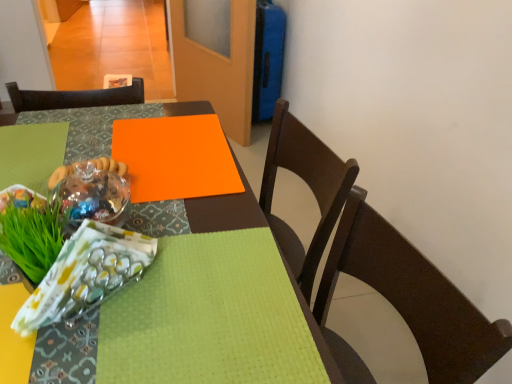
Question: Can green leafy grass at lower left be found inside orange matte board at center?

Choices:
 (A) no
 (B) yes

Answer: (A)

Question: Does orange matte board at center have a lesser width compared to green leafy grass at lower left?

Choices:
 (A) yes
 (B) no

Answer: (B)

Question: From a real-world perspective, is orange matte board at center on green leafy grass at lower left?

Choices:
 (A) yes
 (B) no

Answer: (B)

Question: Is orange matte board at center located outside green leafy grass at lower left?

Choices:
 (A) yes
 (B) no

Answer: (A)

Question: Considering the relative positions of orange matte board at center and green leafy grass at lower left in the image provided, is orange matte board at center to the right of green leafy grass at lower left from the viewer's perspective?

Choices:
 (A) no
 (B) yes

Answer: (B)

Question: Is orange matte board at center closer to camera compared to green leafy grass at lower left?

Choices:
 (A) no
 (B) yes

Answer: (A)

Question: Considering the relative positions of green leafy grass at lower left and matte brown chair at center in the image provided, is green leafy grass at lower left to the right of matte brown chair at center from the viewer's perspective?

Choices:
 (A) yes
 (B) no

Answer: (B)

Question: Is green leafy grass at lower left aimed at matte brown chair at center?

Choices:
 (A) yes
 (B) no

Answer: (B)

Question: Can you confirm if green leafy grass at lower left is bigger than matte brown chair at center?

Choices:
 (A) no
 (B) yes

Answer: (A)

Question: Are green leafy grass at lower left and matte brown chair at center beside each other?

Choices:
 (A) yes
 (B) no

Answer: (B)

Question: Can we say green leafy grass at lower left lies outside matte brown chair at center?

Choices:
 (A) no
 (B) yes

Answer: (B)

Question: Can you confirm if green leafy grass at lower left is positioned to the left of matte brown chair at center?

Choices:
 (A) no
 (B) yes

Answer: (B)

Question: Considering the relative positions of green leafy grass at lower left and translucent plastic bag at lower left in the image provided, is green leafy grass at lower left behind translucent plastic bag at lower left?

Choices:
 (A) yes
 (B) no

Answer: (A)